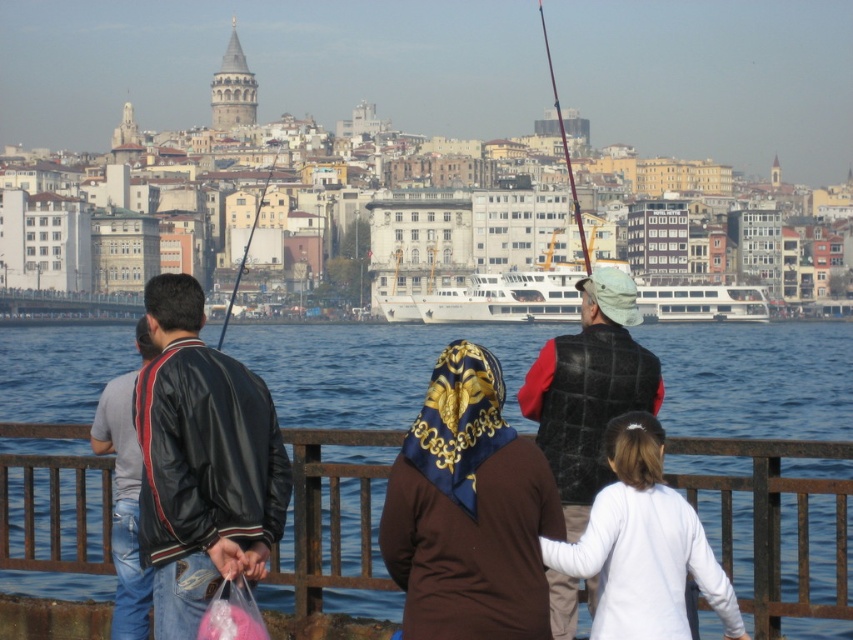
Question: Which point is closer to the camera taking this photo?

Choices:
 (A) pyautogui.click(x=581, y=241)
 (B) pyautogui.click(x=703, y=531)

Answer: (B)

Question: Which of these objects is positioned farthest from the metallic fishing pole at center?

Choices:
 (A) leather jacket at left
 (B) white glossy ferry at center
 (C) brown silk headscarf at center

Answer: (C)

Question: In this image, where is blue water at center located relative to metallic fishing pole at upper center?

Choices:
 (A) right
 (B) left

Answer: (B)

Question: Can you confirm if black leather jacket at left is positioned to the left of quilted black vest at center?

Choices:
 (A) yes
 (B) no

Answer: (A)

Question: Does quilted black vest at center appear on the right side of metallic fishing pole at upper center?

Choices:
 (A) no
 (B) yes

Answer: (A)

Question: Which point is farther from the camera taking this photo?

Choices:
 (A) (253, 221)
 (B) (474, 625)
 (C) (601, 440)

Answer: (A)